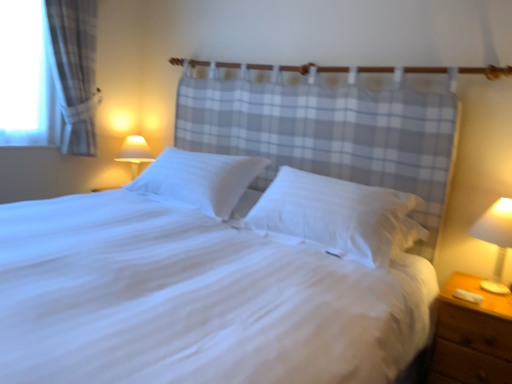
Question: Considering the relative positions of white soft pillow at center, which appears as the 1th pillow when viewed from the right, and white plastic lamp at right in the image provided, is white soft pillow at center, which appears as the 1th pillow when viewed from the right, to the left of white plastic lamp at right from the viewer's perspective?

Choices:
 (A) no
 (B) yes

Answer: (B)

Question: Does white soft pillow at center, which is the second pillow in left-to-right order, have a smaller size compared to white plastic lamp at right?

Choices:
 (A) no
 (B) yes

Answer: (A)

Question: Is white soft pillow at center, which appears as the 1th pillow when viewed from the right, taller than white plastic lamp at right?

Choices:
 (A) no
 (B) yes

Answer: (A)

Question: Does white soft pillow at center, which appears as the 1th pillow when viewed from the right, appear on the right side of white plastic lamp at right?

Choices:
 (A) no
 (B) yes

Answer: (A)

Question: Does white soft pillow at center, which appears as the 1th pillow when viewed from the right, turn towards white plastic lamp at right?

Choices:
 (A) no
 (B) yes

Answer: (A)

Question: In the image, is matte white lampshade at upper left on the left side or the right side of white soft pillow at center, which is the second pillow in left-to-right order?

Choices:
 (A) left
 (B) right

Answer: (A)

Question: Considering their positions, is matte white lampshade at upper left located in front of or behind white soft pillow at center, which appears as the 1th pillow when viewed from the right?

Choices:
 (A) behind
 (B) front

Answer: (A)

Question: Is matte white lampshade at upper left inside the boundaries of white soft pillow at center, which appears as the 1th pillow when viewed from the right, or outside?

Choices:
 (A) outside
 (B) inside

Answer: (A)

Question: From a real-world perspective, is matte white lampshade at upper left physically located above or below white soft pillow at center, which is the second pillow in left-to-right order?

Choices:
 (A) below
 (B) above

Answer: (A)

Question: Is white smooth pillow at center, which appears as the 1th pillow when viewed from the left, bigger or smaller than white plastic lamp at right?

Choices:
 (A) big
 (B) small

Answer: (A)

Question: Considering the positions of white smooth pillow at center, acting as the second pillow starting from the right, and white plastic lamp at right in the image, is white smooth pillow at center, acting as the second pillow starting from the right, wider or thinner than white plastic lamp at right?

Choices:
 (A) thin
 (B) wide

Answer: (B)

Question: Considering their positions, is white smooth pillow at center, acting as the second pillow starting from the right, located in front of or behind white plastic lamp at right?

Choices:
 (A) behind
 (B) front

Answer: (A)

Question: From the image's perspective, is white smooth pillow at center, acting as the second pillow starting from the right, above or below white plastic lamp at right?

Choices:
 (A) above
 (B) below

Answer: (A)

Question: In terms of size, does white smooth bed at center appear bigger or smaller than brown wooden nightstand at lower right?

Choices:
 (A) big
 (B) small

Answer: (A)

Question: From the image's perspective, is white smooth bed at center positioned above or below brown wooden nightstand at lower right?

Choices:
 (A) below
 (B) above

Answer: (B)